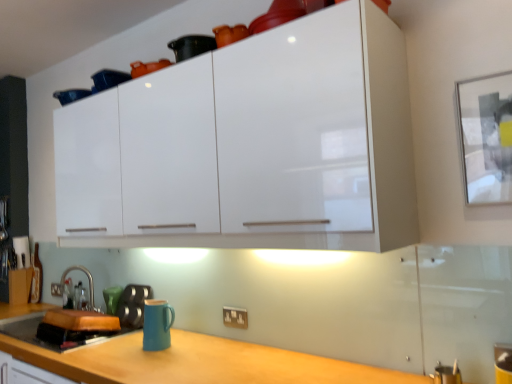
Question: Should I look upward or downward to see matte blue mug at lower center?

Choices:
 (A) down
 (B) up

Answer: (A)

Question: Considering the relative positions of matte black kettle at lower left and satin nickel faucet at lower left in the image provided, is matte black kettle at lower left to the right of satin nickel faucet at lower left from the viewer's perspective?

Choices:
 (A) yes
 (B) no

Answer: (A)

Question: Does matte black kettle at lower left come behind satin nickel faucet at lower left?

Choices:
 (A) yes
 (B) no

Answer: (B)

Question: From the image's perspective, would you say matte black kettle at lower left is positioned over satin nickel faucet at lower left?

Choices:
 (A) no
 (B) yes

Answer: (A)

Question: Considering the relative sizes of matte black kettle at lower left and satin nickel faucet at lower left in the image provided, is matte black kettle at lower left wider than satin nickel faucet at lower left?

Choices:
 (A) yes
 (B) no

Answer: (B)

Question: Can you confirm if matte black kettle at lower left is smaller than satin nickel faucet at lower left?

Choices:
 (A) yes
 (B) no

Answer: (A)

Question: Does matte black kettle at lower left have a greater height compared to satin nickel faucet at lower left?

Choices:
 (A) yes
 (B) no

Answer: (B)

Question: From a real-world perspective, is white glossy cabinet at upper center below satin nickel faucet at lower left?

Choices:
 (A) yes
 (B) no

Answer: (B)

Question: Is white glossy cabinet at upper center outside satin nickel faucet at lower left?

Choices:
 (A) no
 (B) yes

Answer: (B)

Question: Does white glossy cabinet at upper center contain satin nickel faucet at lower left?

Choices:
 (A) yes
 (B) no

Answer: (B)

Question: Is white glossy cabinet at upper center smaller than satin nickel faucet at lower left?

Choices:
 (A) no
 (B) yes

Answer: (A)

Question: Is white glossy cabinet at upper center thinner than satin nickel faucet at lower left?

Choices:
 (A) no
 (B) yes

Answer: (A)

Question: Is white glossy cabinet at upper center wider than satin nickel faucet at lower left?

Choices:
 (A) no
 (B) yes

Answer: (B)

Question: Can you confirm if matte blue mug at lower center is wider than white glossy cabinet at upper center?

Choices:
 (A) yes
 (B) no

Answer: (B)